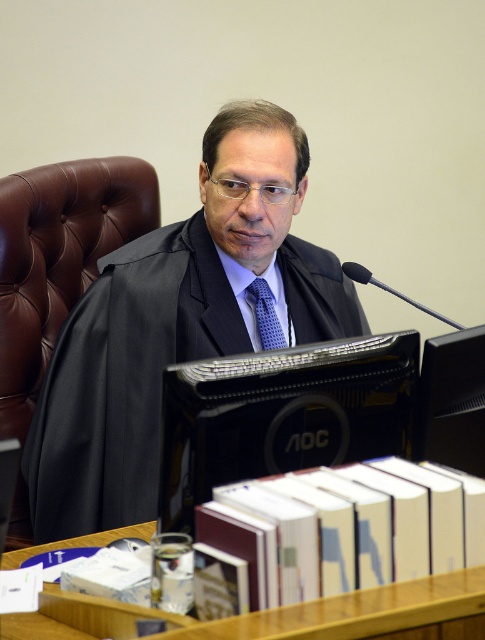
What is the exact 2D coordinate of the black matte business suit at center?

The exact 2D coordinate of the black matte business suit at center is at point (124, 378).

You are an observer in the courtroom. You notice the black matte business suit at center and the blue dotted tie at center. Which one is positioned more to the left?

The black matte business suit at center is positioned more to the left than the blue dotted tie at center.